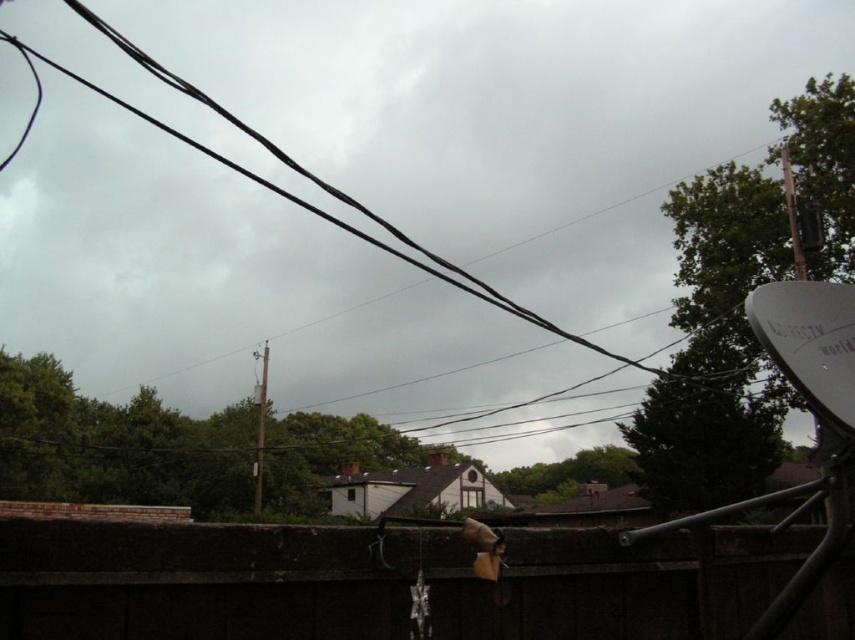
Question: Is brown wooden fence at lower center to the right of smooth gray pole at center from the viewer's perspective?

Choices:
 (A) no
 (B) yes

Answer: (B)

Question: Which is farther from the black wire at upper center?

Choices:
 (A) brown wooden fence at lower center
 (B) smooth gray pole at center

Answer: (A)

Question: From the image, what is the correct spatial relationship of black wire at upper center in relation to smooth gray pole at center?

Choices:
 (A) right
 (B) left

Answer: (B)

Question: Among these objects, which one is farthest from the camera?

Choices:
 (A) black wire at upper center
 (B) brown wooden fence at lower center

Answer: (A)

Question: Does black wire at upper center have a greater width compared to smooth gray pole at center?

Choices:
 (A) yes
 (B) no

Answer: (A)

Question: Which object appears closest to the camera in this image?

Choices:
 (A) black wire at upper center
 (B) brown wooden fence at lower center
 (C) smooth gray pole at center

Answer: (B)